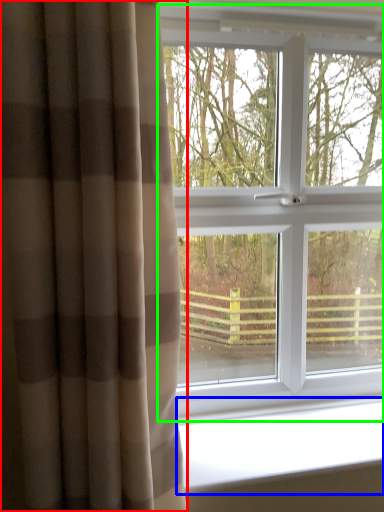
Question: Estimate the real-world distances between objects in this image. Which object is closer to curtain (highlighted by a red box), window sill (highlighted by a blue box) or window (highlighted by a green box)?

Choices:
 (A) window sill
 (B) window

Answer: (A)